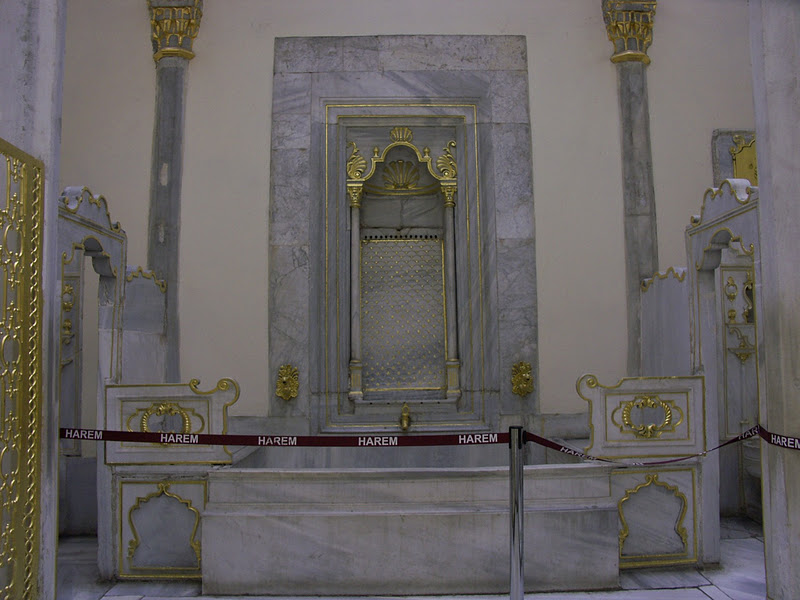
Where is `the left marble bench`? Image resolution: width=800 pixels, height=600 pixels. the left marble bench is located at coordinates (238, 422).